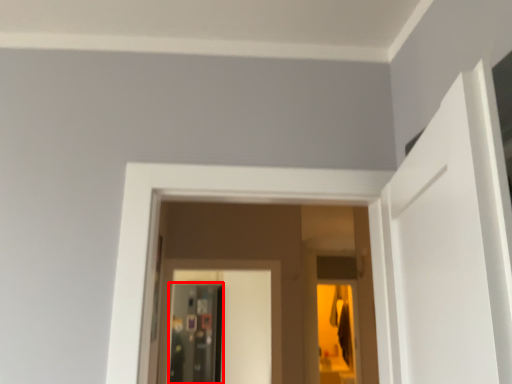
Question: Observing the image, what is the correct spatial positioning of screen door (annotated by the red box) in reference to screen door?

Choices:
 (A) right
 (B) left

Answer: (B)